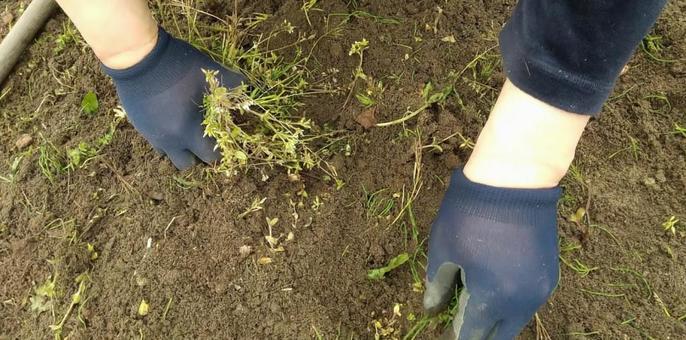
This screenshot has width=686, height=340. I want to click on handle, so click(16, 38).